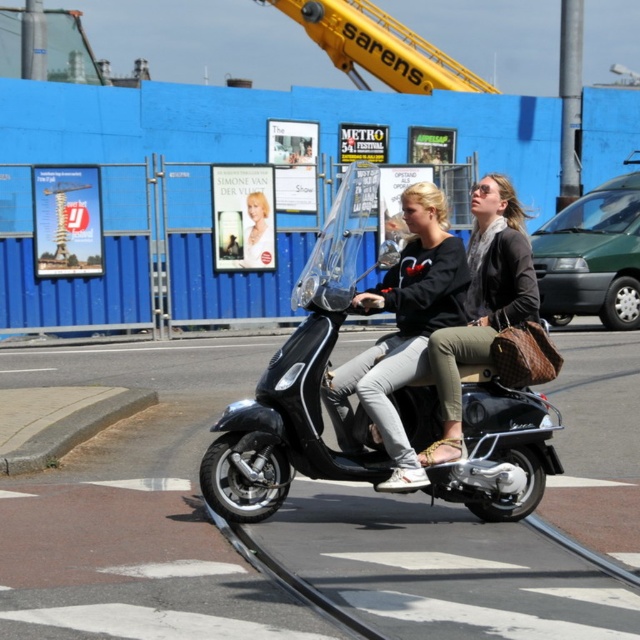
Question: Is black matte scooter at center to the right of blonde hair at center from the viewer's perspective?

Choices:
 (A) yes
 (B) no

Answer: (A)

Question: Which point is farther to the camera?

Choices:
 (A) blonde hair at center
 (B) black matte sweatshirt at center
 (C) black matte scooter at center

Answer: (A)

Question: Can you confirm if black matte sweatshirt at center is positioned below matte black scooter at center?

Choices:
 (A) no
 (B) yes

Answer: (B)

Question: Does black matte sweatshirt at center appear on the left side of blonde hair at center?

Choices:
 (A) yes
 (B) no

Answer: (B)

Question: Estimate the real-world distances between objects in this image. Which object is closer to the black matte scooter at center?

Choices:
 (A) black matte sweatshirt at center
 (B) blonde hair at center

Answer: (A)

Question: Estimate the real-world distances between objects in this image. Which object is closer to the black matte scooter at center?

Choices:
 (A) matte black scooter at center
 (B) black matte sweatshirt at center

Answer: (B)